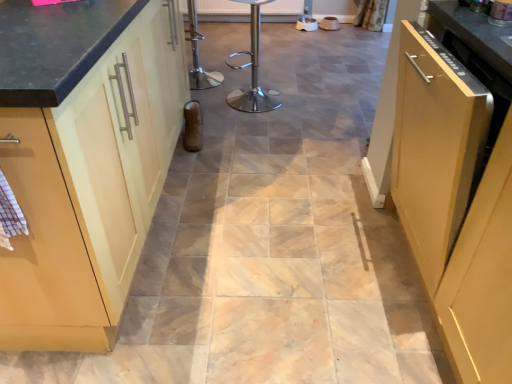
Question: From a real-world perspective, is matte wood cabinet at right, marked as the first cabinetry in a right-to-left arrangement, physically located above or below metallic silver dishwasher at upper right?

Choices:
 (A) above
 (B) below

Answer: (B)

Question: Visually, is matte wood cabinet at right, marked as the second cabinetry in a left-to-right arrangement, positioned to the left or to the right of metallic silver dishwasher at upper right?

Choices:
 (A) right
 (B) left

Answer: (A)

Question: Estimate the real-world distances between objects in this image. Which object is farther from the matte wood cabinet at left, which is counted as the 2th cabinetry, starting from the right?

Choices:
 (A) matte wood cabinet at right, marked as the first cabinetry in a right-to-left arrangement
 (B) polished stainless steel bar stool at center
 (C) metallic silver dishwasher at upper right

Answer: (B)

Question: Based on their relative distances, which object is nearer to the matte wood cabinet at right, marked as the first cabinetry in a right-to-left arrangement?

Choices:
 (A) polished stainless steel bar stool at center
 (B) matte wood cabinet at left, which is counted as the 2th cabinetry, starting from the right
 (C) metallic silver dishwasher at upper right

Answer: (C)